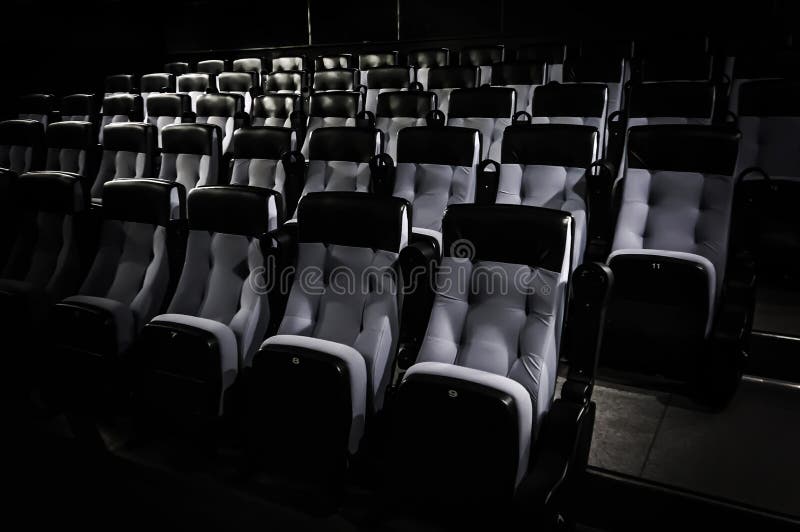
Where is `white numbers on bottom of chair`? white numbers on bottom of chair is located at coordinates (654, 270), (453, 390), (296, 362), (172, 332).